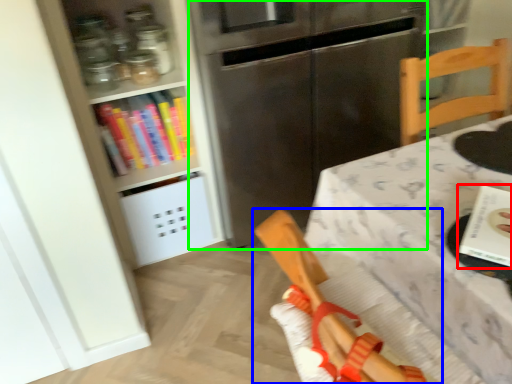
Question: Estimate the real-world distances between objects in this image. Which object is farther from book (highlighted by a red box), chair (highlighted by a blue box) or fridge (highlighted by a green box)?

Choices:
 (A) chair
 (B) fridge

Answer: (B)